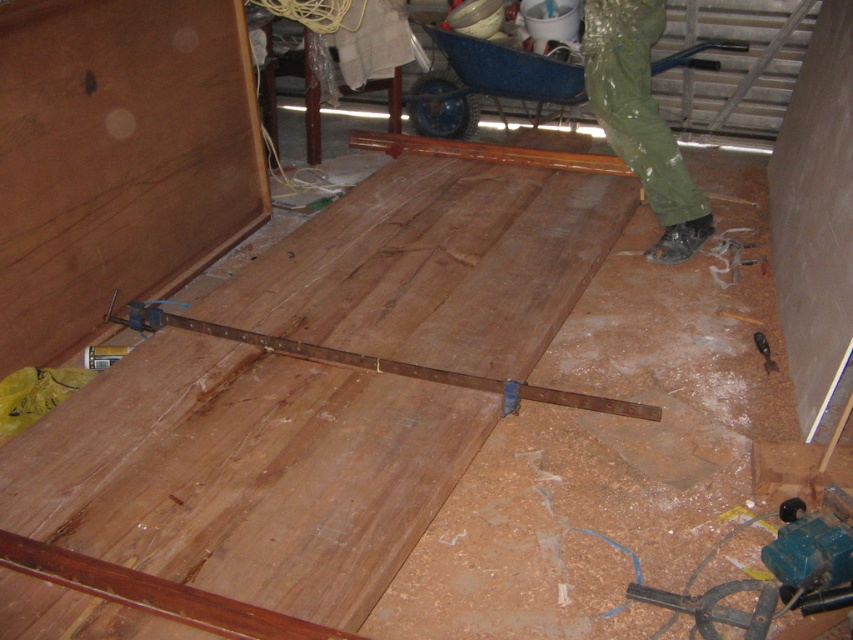
In the scene shown: You are a contractor working on a flooring project and need to choose between the green rubber pants at center and the rusty metal ruler at center for measuring the wooden planks. Which object is more suitable for taking precise measurements?

The rusty metal ruler at center is more suitable for taking precise measurements because it is larger than the green rubber pants at center, which is smaller and not designed for measurement purposes.

Where is the green rubber pants at center located in the image?

The green rubber pants at center is located at point (641, 120) in the image.

You are a worker who needs to move from the green rubber pants at center to the blue wheelbarrow in the background. The path between them is clear. What is the minimum distance you need to walk?

The minimum distance you need to walk is 2.81 meters because the green rubber pants at center and the blue wheelbarrow in the background are 2.81 meters apart.